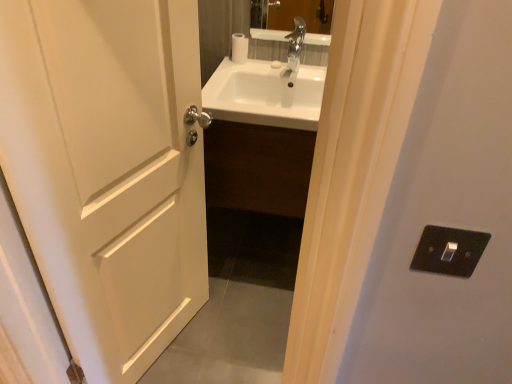
Question: Considering the relative sizes of white matte door at left and black plastic switch at right in the image provided, is white matte door at left thinner than black plastic switch at right?

Choices:
 (A) no
 (B) yes

Answer: (B)

Question: Can you confirm if white matte door at left is positioned to the right of black plastic switch at right?

Choices:
 (A) yes
 (B) no

Answer: (B)

Question: From a real-world perspective, is white matte door at left positioned under black plastic switch at right based on gravity?

Choices:
 (A) no
 (B) yes

Answer: (B)

Question: From a real-world perspective, is white matte door at left on top of black plastic switch at right?

Choices:
 (A) yes
 (B) no

Answer: (B)

Question: Is white matte door at left wider than black plastic switch at right?

Choices:
 (A) yes
 (B) no

Answer: (B)

Question: Is point (306, 162) closer or farther from the camera than point (457, 345)?

Choices:
 (A) farther
 (B) closer

Answer: (A)

Question: Is white glossy sink at center taller or shorter than black plastic switch at right?

Choices:
 (A) tall
 (B) short

Answer: (B)

Question: From the image's perspective, relative to black plastic switch at right, is white glossy sink at center above or below?

Choices:
 (A) above
 (B) below

Answer: (A)

Question: In terms of size, does white glossy sink at center appear bigger or smaller than black plastic switch at right?

Choices:
 (A) small
 (B) big

Answer: (B)

Question: In terms of width, does white matte door at left look wider or thinner when compared to white glossy sink at center?

Choices:
 (A) wide
 (B) thin

Answer: (B)

Question: From a real-world perspective, is white matte door at left physically located above or below white glossy sink at center?

Choices:
 (A) below
 (B) above

Answer: (B)

Question: Is white matte door at left bigger or smaller than white glossy sink at center?

Choices:
 (A) small
 (B) big

Answer: (B)

Question: In the image, is white matte door at left positioned in front of or behind white glossy sink at center?

Choices:
 (A) front
 (B) behind

Answer: (A)

Question: From the image's perspective, relative to white matte toilet paper at upper center, is black plastic switch at right above or below?

Choices:
 (A) above
 (B) below

Answer: (B)

Question: Based on their positions, is black plastic switch at right located to the left or right of white matte toilet paper at upper center?

Choices:
 (A) left
 (B) right

Answer: (B)